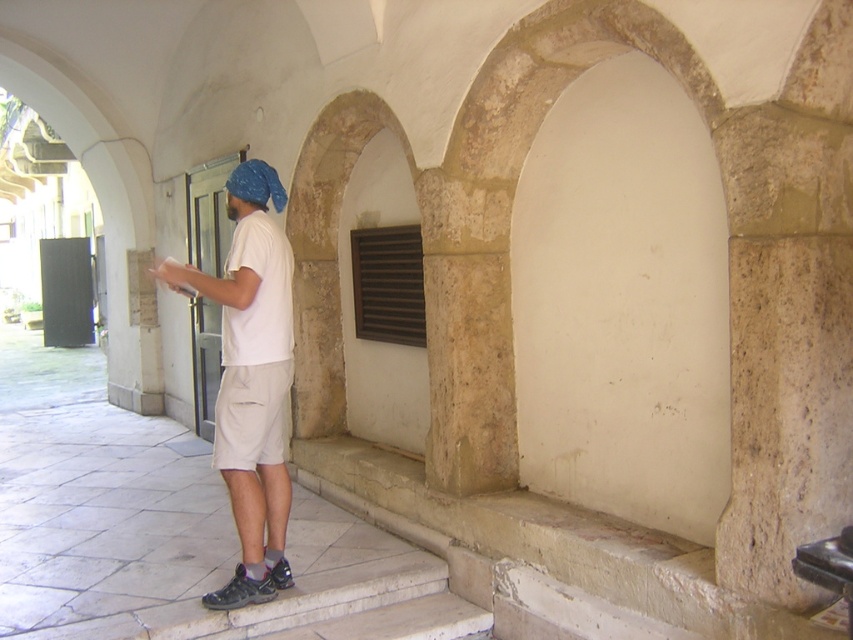
Question: Among these objects, which one is farthest from the camera?

Choices:
 (A) white matte shirt at center
 (B) white cotton shirt at center

Answer: (A)

Question: Does beige cotton shorts at center have a greater width compared to blue fabric headscarf at upper left?

Choices:
 (A) no
 (B) yes

Answer: (B)

Question: Which object is closer to the camera taking this photo?

Choices:
 (A) white matte shirt at center
 (B) beige cotton shorts at center

Answer: (A)

Question: Considering the real-world distances, which object is closest to the blue fabric headscarf at upper left?

Choices:
 (A) white matte shirt at center
 (B) beige cotton shorts at center

Answer: (A)

Question: Can you confirm if white matte shirt at center is positioned to the left of beige cotton shorts at center?

Choices:
 (A) yes
 (B) no

Answer: (A)

Question: Does white cotton shirt at center have a larger size compared to white matte shirt at center?

Choices:
 (A) yes
 (B) no

Answer: (A)